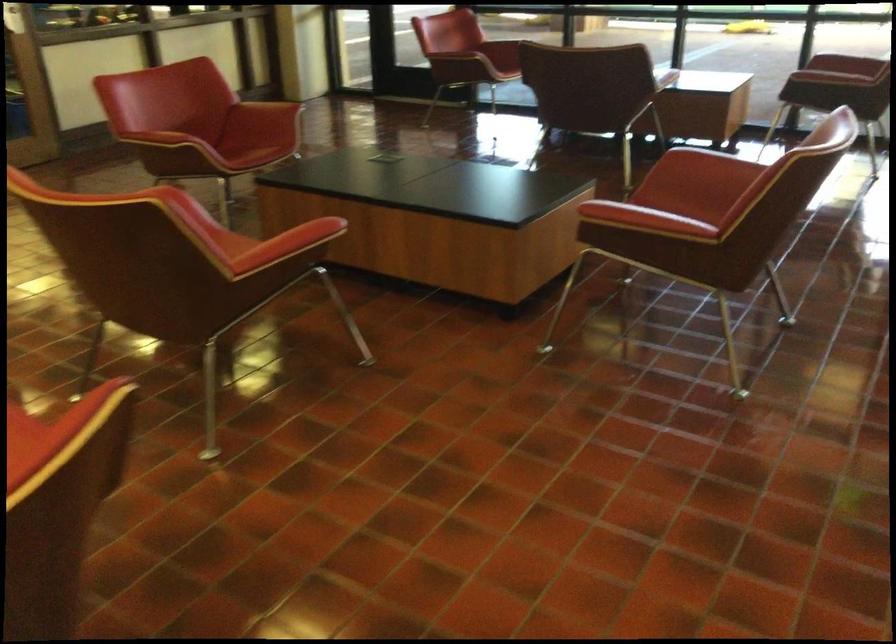
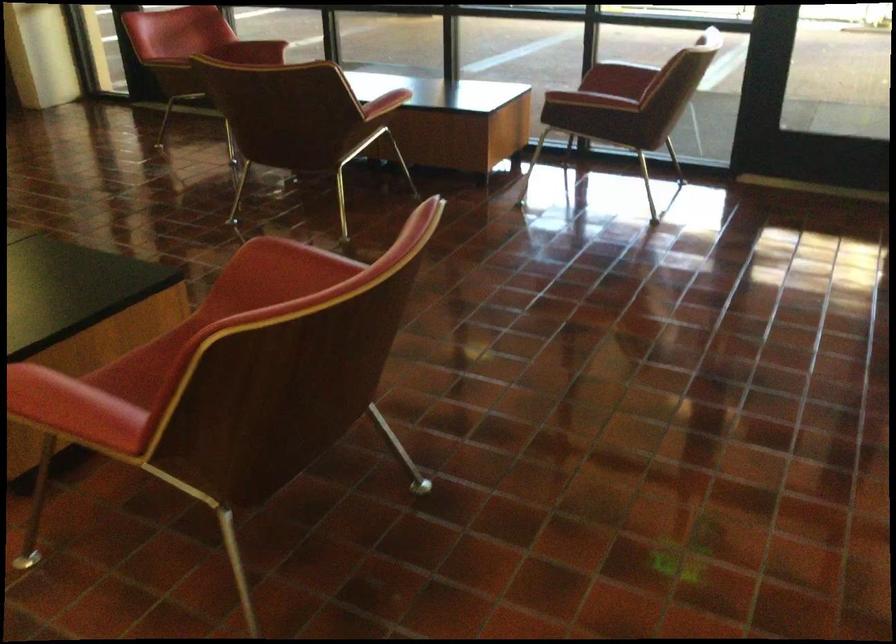
From the picture: What movement of the cameraman would produce the second image?

The cameraman walked toward right, forward.